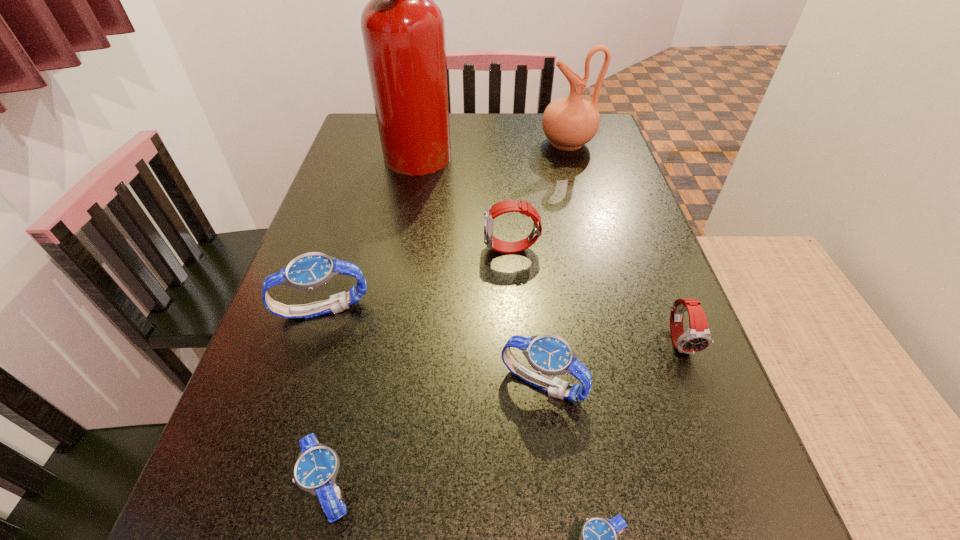
Where is `free space between the third smallest blue watch and the rightmost watch`? This screenshot has width=960, height=540. free space between the third smallest blue watch and the rightmost watch is located at coordinates (612, 362).

Locate an element on the screen. This screenshot has height=540, width=960. free space between the tallest object and the seventh tallest object is located at coordinates (374, 318).

In order to click on unoccupied position between the farthest watch and the third biggest blue watch in this screenshot , I will do `click(420, 368)`.

Identify the location of object that ranks as the sixth closest to the seventh shortest object. (315, 471).

Identify the location of object that is the fifth closest to the shortest object. The image size is (960, 540). (502, 207).

Choose which watch is the fourth nearest neighbor to the smallest blue watch. Please provide its 2D coordinates. Your answer should be formatted as a tuple, i.e. [(x, y)], where the tuple contains the x and y coordinates of a point satisfying the conditions above.

[(308, 271)]

Where is `watch that can be found as the closest to the farthest watch`? watch that can be found as the closest to the farthest watch is located at coordinates 308,271.

Select which blue watch appears as the closest to the second tallest object. Please provide its 2D coordinates. Your answer should be formatted as a tuple, i.e. [(x, y)], where the tuple contains the x and y coordinates of a point satisfying the conditions above.

[(308, 271)]

Choose which blue watch is the third nearest neighbor to the third smallest blue watch. Please provide its 2D coordinates. Your answer should be formatted as a tuple, i.e. [(x, y)], where the tuple contains the x and y coordinates of a point satisfying the conditions above.

[(308, 271)]

At what (x,y) coordinates should I click in order to perform the action: click on blank space that satisfies the following two spatial constraints: 1. on the back side of the second biggest blue watch; 2. on the face of the left red watch. Please return your answer as a coordinate pair (x, y). Looking at the image, I should click on (528, 249).